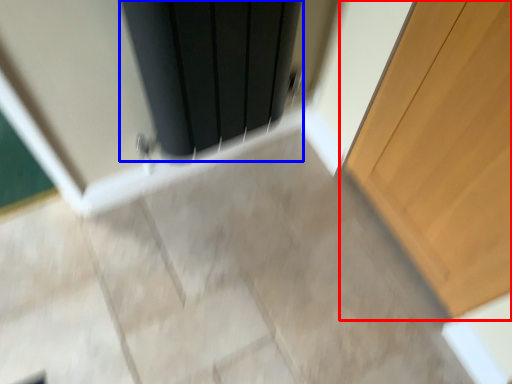
Question: Which object is closer to the camera taking this photo, door (highlighted by a red box) or screen door (highlighted by a blue box)?

Choices:
 (A) door
 (B) screen door

Answer: (A)